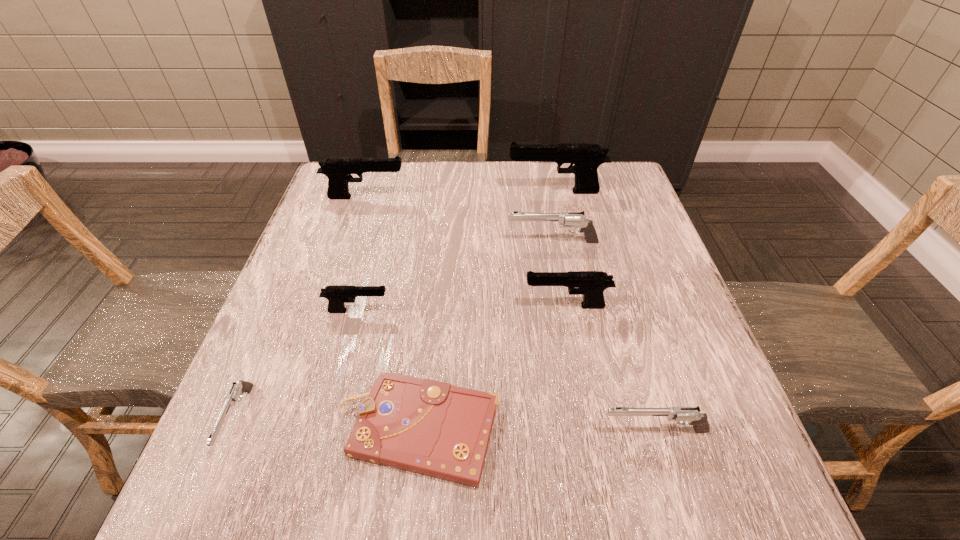
This screenshot has width=960, height=540. Identify the location of vacant space located 0.060m on the front-facing side of the third farthest object. (482, 242).

Locate an element on the screen. Image resolution: width=960 pixels, height=540 pixels. vacant space situated on the front-facing side of the third farthest object is located at coordinates coord(478,242).

Identify the location of vacant region located 0.100m on the front-facing side of the third farthest object. The height and width of the screenshot is (540, 960). (466, 242).

Locate an element on the screen. vacant space situated 0.090m on the front-facing side of the smallest black pistol is located at coordinates (433, 311).

What are the coordinates of `vacant space located 0.250m on the front-facing side of the second smallest silver pistol` in the screenshot? It's located at [x=452, y=430].

Where is `vacant space located 0.180m on the front-facing side of the second smallest silver pistol`? Image resolution: width=960 pixels, height=540 pixels. vacant space located 0.180m on the front-facing side of the second smallest silver pistol is located at coordinates (493, 430).

Where is `vacant area situated on the front-facing side of the second smallest silver pistol`? vacant area situated on the front-facing side of the second smallest silver pistol is located at coordinates (380, 430).

Locate an element on the screen. The width and height of the screenshot is (960, 540). vacant space located on the right of the notebook is located at coordinates (713, 429).

Where is `object located at the near edge`? The height and width of the screenshot is (540, 960). object located at the near edge is located at coordinates (424, 426).

Where is `object that is positioned at the far left corner`? object that is positioned at the far left corner is located at coordinates (338, 170).